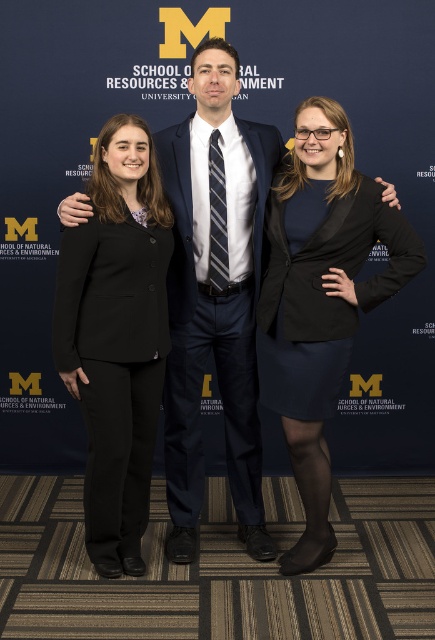
Question: Which point is farther from the camera taking this photo?

Choices:
 (A) (364, 196)
 (B) (106, 248)
 (C) (247, 156)

Answer: (C)

Question: Can you confirm if matte black blazer at center is smaller than black wool business suit at left?

Choices:
 (A) no
 (B) yes

Answer: (A)

Question: From the image, what is the correct spatial relationship of matte black suit at center in relation to navy blue fabric business suit at center?

Choices:
 (A) below
 (B) above

Answer: (B)

Question: Can you confirm if matte black blazer at center is positioned to the left of navy blue fabric business suit at center?

Choices:
 (A) yes
 (B) no

Answer: (B)

Question: Considering the real-world distances, which object is farthest from the matte black blazer at center?

Choices:
 (A) navy blue fabric business suit at center
 (B) matte black suit at center

Answer: (B)

Question: Considering the real-world distances, which object is farthest from the matte black blazer at center?

Choices:
 (A) navy blue fabric business suit at center
 (B) matte black suit at center

Answer: (B)